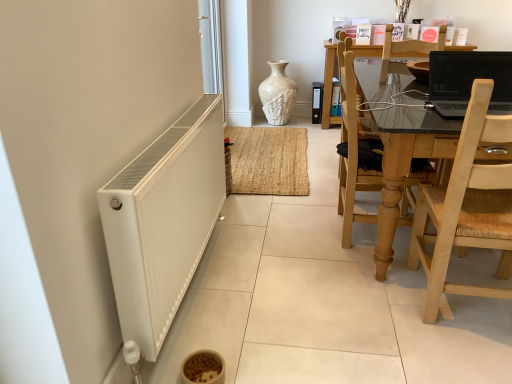
Where is `free point behind white matte radiator at lower left`? free point behind white matte radiator at lower left is located at coordinates click(x=265, y=218).